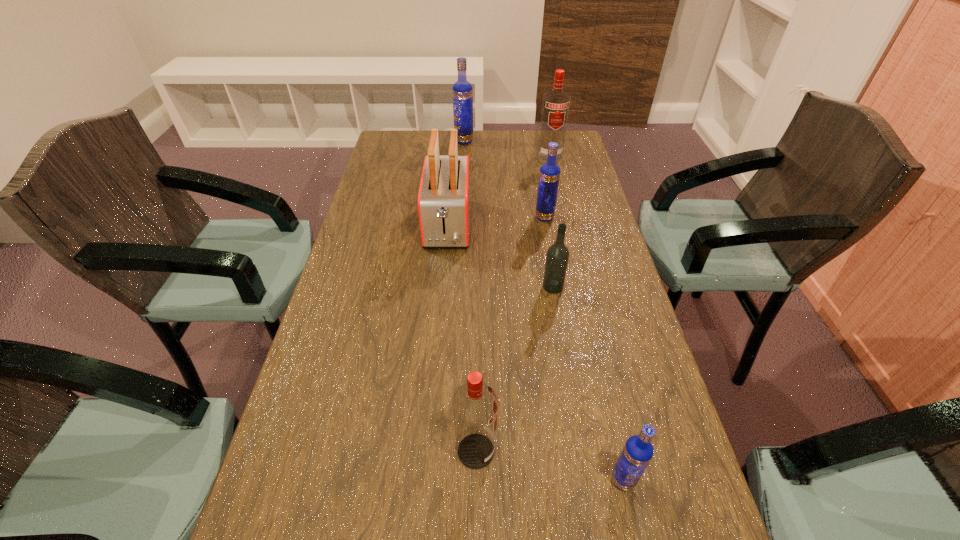
You are a GUI agent. You are given a task and a screenshot of the screen. Output one action in this format:
    pyautogui.click(x=<x>, y=<y>)
    Task: Click on the farthest object
    This screenshot has height=540, width=960.
    Given the screenshot: What is the action you would take?
    pyautogui.click(x=462, y=90)

Where is `the leftmost blue vodka`? the leftmost blue vodka is located at coordinates (462, 90).

The image size is (960, 540). What are the coordinates of `the second farthest vodka` in the screenshot? It's located at (556, 103).

The width and height of the screenshot is (960, 540). What are the coordinates of `the bigger red vodka` in the screenshot? It's located at (556, 103).

Identify the location of toaster. (444, 194).

Find the location of a particular element. This screenshot has width=960, height=540. the second blue vodka from right to left is located at coordinates 549,175.

I want to click on the second biggest blue vodka, so click(x=549, y=175).

What are the coordinates of `the nearer red vodka` in the screenshot? It's located at (475, 404).

At what (x,y) coordinates should I click in order to perform the action: click on the smaller red vodka. Please return your answer as a coordinate pair (x, y). Looking at the image, I should click on (475, 404).

What are the coordinates of `the fourth farthest vodka` in the screenshot? It's located at (557, 257).